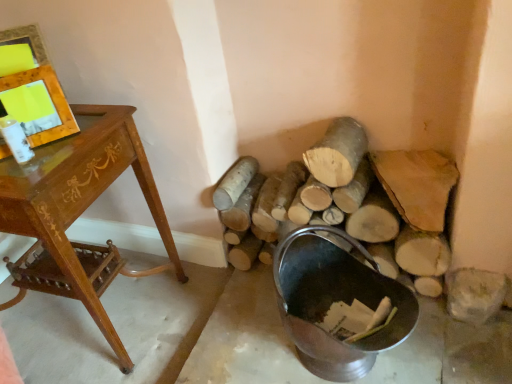
Question: Should I look upward or downward to see metallic bucket at lower right?

Choices:
 (A) up
 (B) down

Answer: (B)

Question: Is natural wood log at center, positioned as the 2th log in right-to-left order, closer to camera compared to wooden desk at left?

Choices:
 (A) yes
 (B) no

Answer: (B)

Question: Can you confirm if natural wood log at center, positioned as the 2th log in right-to-left order, is taller than wooden desk at left?

Choices:
 (A) yes
 (B) no

Answer: (B)

Question: Can you confirm if natural wood log at center, positioned as the 2th log in right-to-left order, is thinner than wooden desk at left?

Choices:
 (A) yes
 (B) no

Answer: (A)

Question: Does natural wood log at center, marked as the 1th log in a left-to-right arrangement, have a larger size compared to wooden desk at left?

Choices:
 (A) no
 (B) yes

Answer: (A)

Question: From a real-world perspective, is natural wood log at center, positioned as the 2th log in right-to-left order, positioned over wooden desk at left based on gravity?

Choices:
 (A) yes
 (B) no

Answer: (B)

Question: Is natural wood log at center, positioned as the 2th log in right-to-left order, to the left of wooden desk at left from the viewer's perspective?

Choices:
 (A) no
 (B) yes

Answer: (A)

Question: Is wooden frame at upper left not within wooden desk at left?

Choices:
 (A) yes
 (B) no

Answer: (A)

Question: From the image's perspective, is wooden frame at upper left on wooden desk at left?

Choices:
 (A) yes
 (B) no

Answer: (A)

Question: Is wooden frame at upper left positioned behind wooden desk at left?

Choices:
 (A) yes
 (B) no

Answer: (A)

Question: Is wooden frame at upper left thinner than wooden desk at left?

Choices:
 (A) yes
 (B) no

Answer: (A)

Question: From a real-world perspective, is wooden frame at upper left below wooden desk at left?

Choices:
 (A) no
 (B) yes

Answer: (A)

Question: Considering the relative sizes of wooden frame at upper left and wooden desk at left in the image provided, is wooden frame at upper left bigger than wooden desk at left?

Choices:
 (A) no
 (B) yes

Answer: (A)

Question: From a real-world perspective, is wooden frame at upper left positioned under metallic bucket at lower right based on gravity?

Choices:
 (A) no
 (B) yes

Answer: (A)